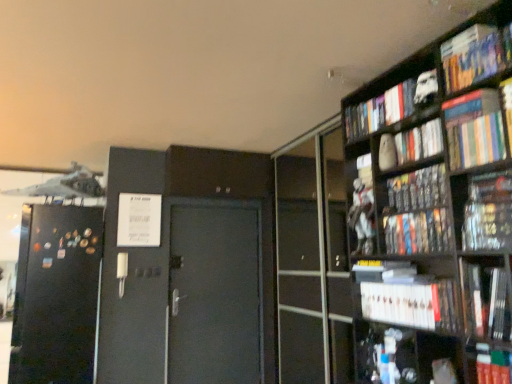
Question: In terms of size, does hardcover book at lower right, the first book positioned from the bottom, appear bigger or smaller than white matte bookshelf at lower right, the 2th book ordered from the bottom?

Choices:
 (A) big
 (B) small

Answer: (B)

Question: Is hardcover book at lower right, the first book positioned from the bottom, taller or shorter than white matte bookshelf at lower right, the 2th book ordered from the bottom?

Choices:
 (A) tall
 (B) short

Answer: (A)

Question: Which is nearer to the hardcover book at lower right, the first book positioned from the bottom?

Choices:
 (A) white matte figurine at upper right, which ranks as the tenth book in bottom-to-top order
 (B) hardcover book at upper right, arranged as the 4th book when ordered from the bottom
 (C) black matte refrigerator at left
 (D) matte black book at upper right, placed as the fifth book when sorted from top to bottom
 (E) hardcover book at right, the seventh book from the top

Answer: (B)

Question: Which object is positioned farthest from the hardcover book at right, arranged as the 5th book when ordered from the bottom?

Choices:
 (A) black matte refrigerator at left
 (B) hardcover book at upper right, arranged as the 4th book when ordered from the bottom
 (C) matte black book at upper right, placed as the fifth book when sorted from top to bottom
 (D) hardcover books at upper right, positioned as the 4th book in top-to-bottom order
 (E) white matte figurine at upper right, the 2th book from the top

Answer: (A)